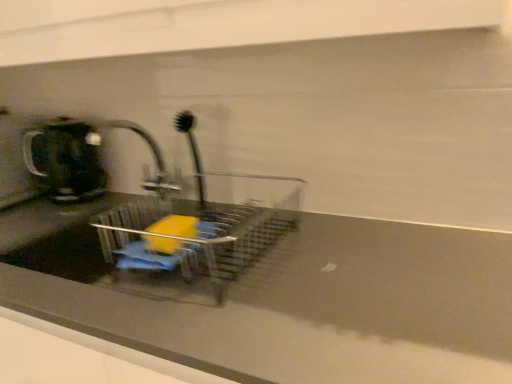
Question: Is matte gray counter top at center closer to the viewer compared to matte black coffeepot at left?

Choices:
 (A) no
 (B) yes

Answer: (B)

Question: From a real-world perspective, is matte gray counter top at center physically above matte black coffeepot at left?

Choices:
 (A) no
 (B) yes

Answer: (A)

Question: Is matte gray counter top at center with matte black coffeepot at left?

Choices:
 (A) no
 (B) yes

Answer: (A)

Question: Is matte gray counter top at center completely or partially outside of matte black coffeepot at left?

Choices:
 (A) yes
 (B) no

Answer: (A)

Question: Is the depth of matte gray counter top at center greater than that of matte black coffeepot at left?

Choices:
 (A) no
 (B) yes

Answer: (A)

Question: Can you confirm if matte gray counter top at center is smaller than matte black coffeepot at left?

Choices:
 (A) yes
 (B) no

Answer: (B)

Question: Is matte black coffeepot at left behind clear plastic sink at center?

Choices:
 (A) no
 (B) yes

Answer: (B)

Question: Is matte black coffeepot at left looking in the opposite direction of clear plastic sink at center?

Choices:
 (A) no
 (B) yes

Answer: (A)

Question: Is matte black coffeepot at left to the left of clear plastic sink at center from the viewer's perspective?

Choices:
 (A) yes
 (B) no

Answer: (A)

Question: Is matte black coffeepot at left directly adjacent to clear plastic sink at center?

Choices:
 (A) no
 (B) yes

Answer: (A)

Question: Considering the relative positions of matte black coffeepot at left and clear plastic sink at center in the image provided, is matte black coffeepot at left to the right of clear plastic sink at center from the viewer's perspective?

Choices:
 (A) no
 (B) yes

Answer: (A)

Question: Does matte black coffeepot at left have a greater height compared to clear plastic sink at center?

Choices:
 (A) yes
 (B) no

Answer: (A)

Question: Is brushed metal tap at center completely or partially inside matte black coffeepot at left?

Choices:
 (A) yes
 (B) no

Answer: (B)